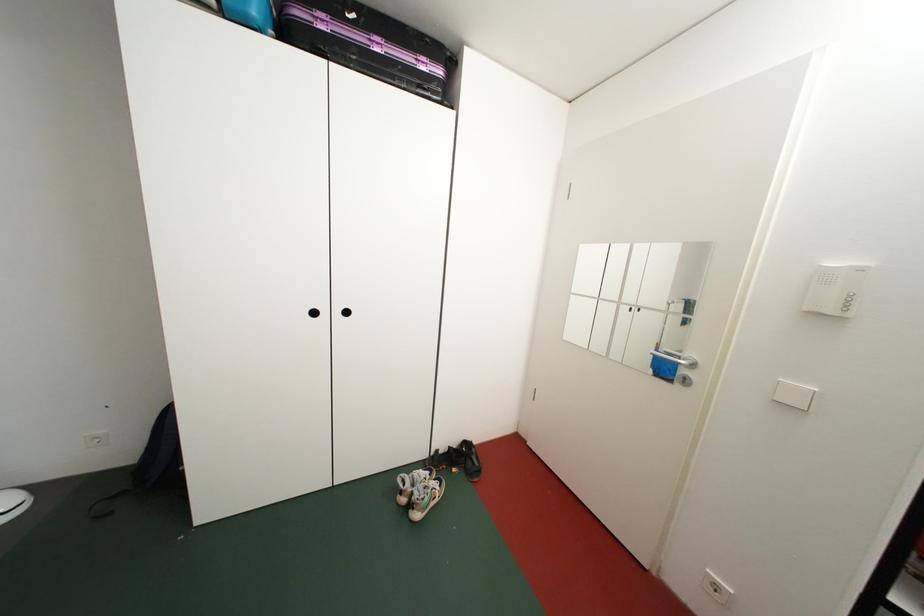
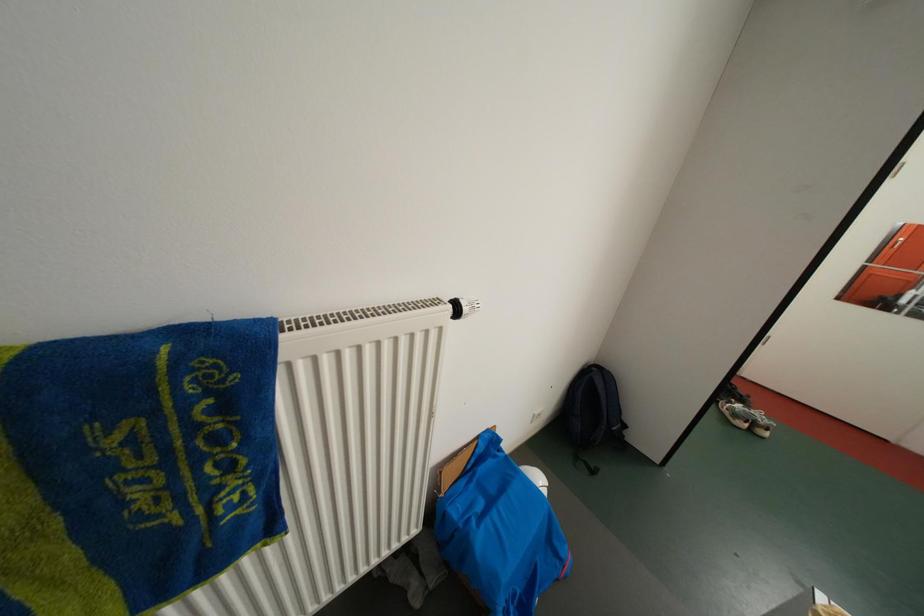
Question: The images are taken continuously from a first-person perspective. In which direction are you moving?

Choices:
 (A) Left
 (B) Right
 (C) Forward
 (D) Backward

Answer: (A)